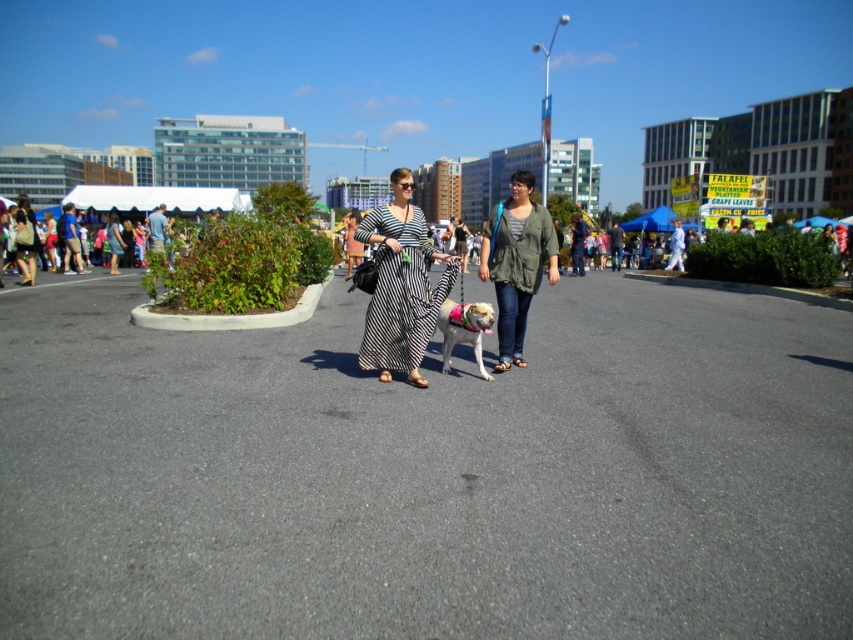
You are a photographer planning to take a portrait of the two people in the scene. You want to ensure that both the black striped dress at center and the green textured jacket at center are clearly visible in the frame. Given their sizes, which clothing item should you focus on to ensure both are in focus?

The black striped dress at center has a smaller size compared to green textured jacket at center. To ensure both are in focus, focus on the green textured jacket at center since it is larger and will be easier to capture clearly, allowing the smaller black striped dress at center to also stay within the depth of field.

You are standing in the outdoor urban scene and want to take a photo of both the point at coordinates point (398, 275) and point (520, 264). Which point should you focus on first to ensure both are in focus?

You should focus on point (398, 275) first because it is closer to the camera than point (520, 264), ensuring both points are within the depth of field.

You are a photographer trying to capture a candid shot of both the black striped dress at center and the green textured jacket at center. Since you want to ensure both are visible in the frame, which person should you focus on first to avoid blocking the view?

You should focus on the black striped dress at center first because it is in front of the green textured jacket at center, so capturing it first ensures the background subject remains visible without obstruction.